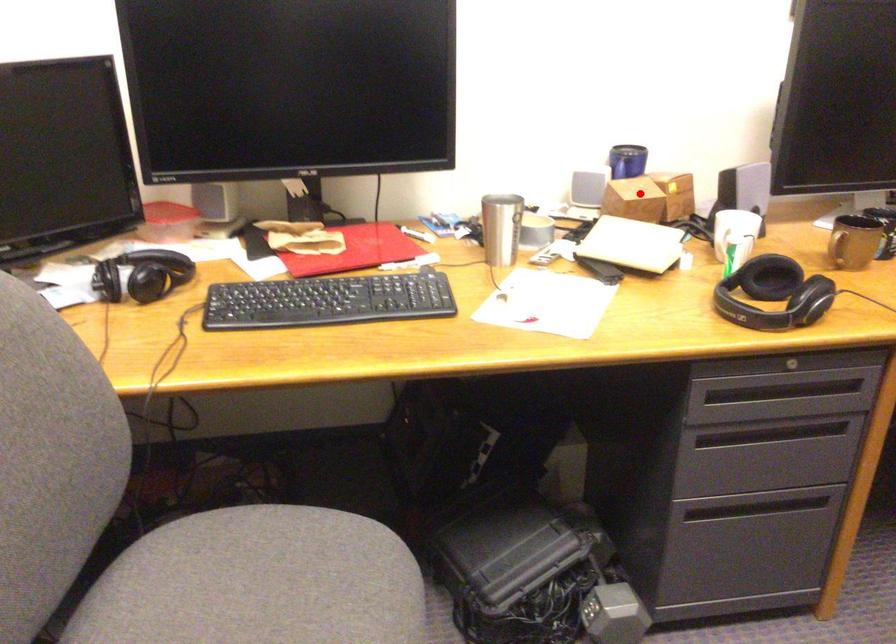
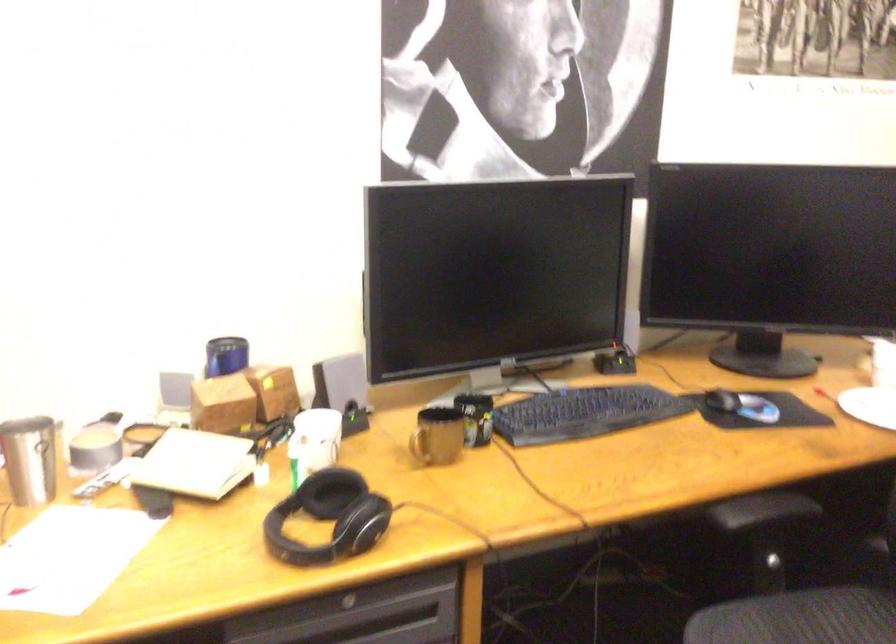
In the second image, find the point that corresponds to the highlighted location in the first image.

(222, 404)